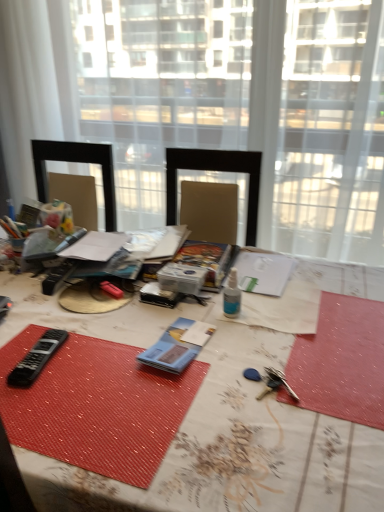
Find the location of a particular element. vacant space behind blue paper at center, which is the second equipment in left-to-right order is located at coordinates (169, 312).